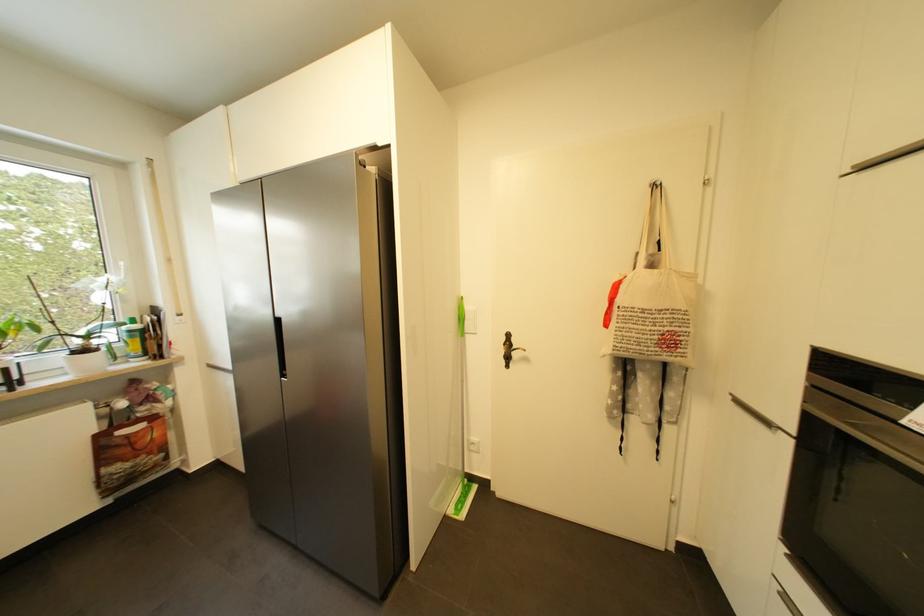
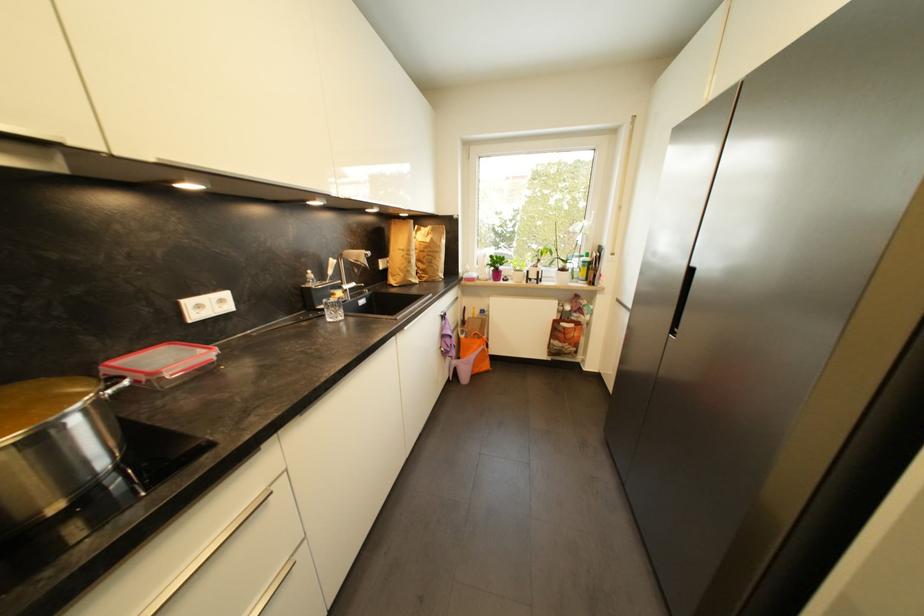
Locate, in the second image, the point that corresponds to the point at 278,342 in the first image.

(682, 296)